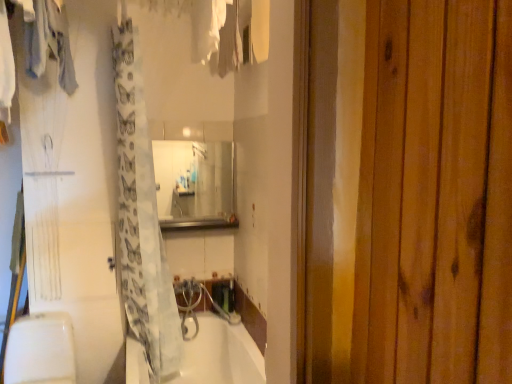
Question: Does light gray fabric at upper left, which is the first clothing from left to right, have a greater width compared to clear glass mirror at center?

Choices:
 (A) yes
 (B) no

Answer: (A)

Question: From a real-world perspective, is light gray fabric at upper left, acting as the 2th clothing starting from the right, on clear glass mirror at center?

Choices:
 (A) yes
 (B) no

Answer: (A)

Question: Considering the relative sizes of light gray fabric at upper left, which is the first clothing from left to right, and clear glass mirror at center in the image provided, is light gray fabric at upper left, which is the first clothing from left to right, smaller than clear glass mirror at center?

Choices:
 (A) no
 (B) yes

Answer: (A)

Question: Are light gray fabric at upper left, which is the first clothing from left to right, and clear glass mirror at center beside each other?

Choices:
 (A) yes
 (B) no

Answer: (B)

Question: From the image's perspective, is light gray fabric at upper left, which is the first clothing from left to right, beneath clear glass mirror at center?

Choices:
 (A) no
 (B) yes

Answer: (A)

Question: Is light gray fabric at upper left, which is the first clothing from left to right, positioned in front of clear glass mirror at center?

Choices:
 (A) no
 (B) yes

Answer: (B)

Question: Is clear glass mirror at center surrounded by translucent white shower curtain at center?

Choices:
 (A) no
 (B) yes

Answer: (A)

Question: From the image's perspective, would you say translucent white shower curtain at center is positioned over clear glass mirror at center?

Choices:
 (A) yes
 (B) no

Answer: (B)

Question: Does translucent white shower curtain at center have a greater height compared to clear glass mirror at center?

Choices:
 (A) no
 (B) yes

Answer: (B)

Question: Is the position of translucent white shower curtain at center more distant than that of clear glass mirror at center?

Choices:
 (A) yes
 (B) no

Answer: (B)

Question: Does translucent white shower curtain at center have a larger size compared to clear glass mirror at center?

Choices:
 (A) no
 (B) yes

Answer: (B)

Question: From the image's perspective, is translucent white shower curtain at center under clear glass mirror at center?

Choices:
 (A) yes
 (B) no

Answer: (A)

Question: Is there a large distance between metallic stainless steel at center and clear glass mirror at center?

Choices:
 (A) yes
 (B) no

Answer: (B)